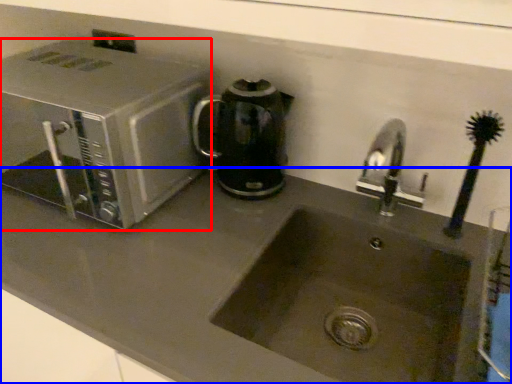
Question: Which of the following is the closest to the observer, microwave oven (highlighted by a red box) or counter top (highlighted by a blue box)?

Choices:
 (A) microwave oven
 (B) counter top

Answer: (B)